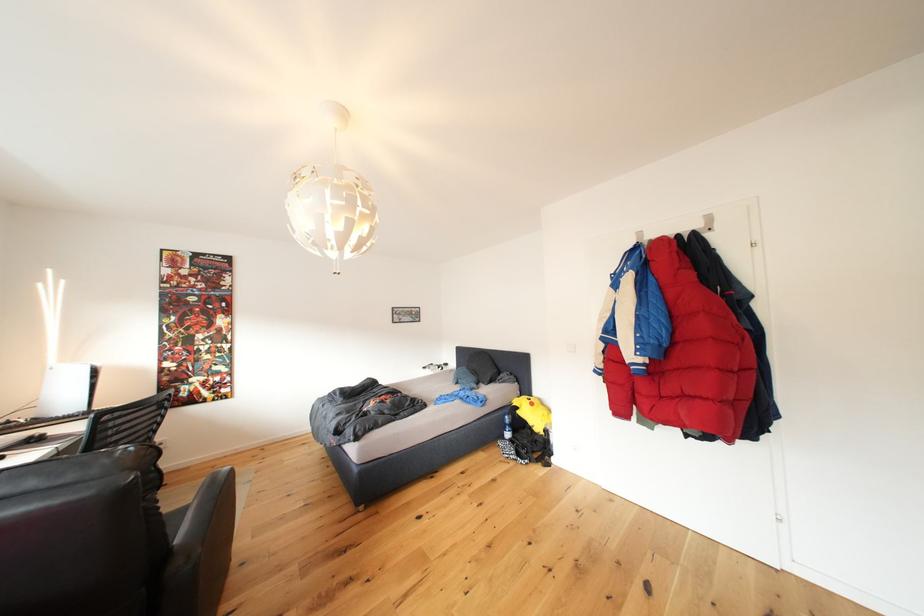
The image size is (924, 616). Describe the element at coordinates (506, 426) in the screenshot. I see `the plastic water bottle` at that location.